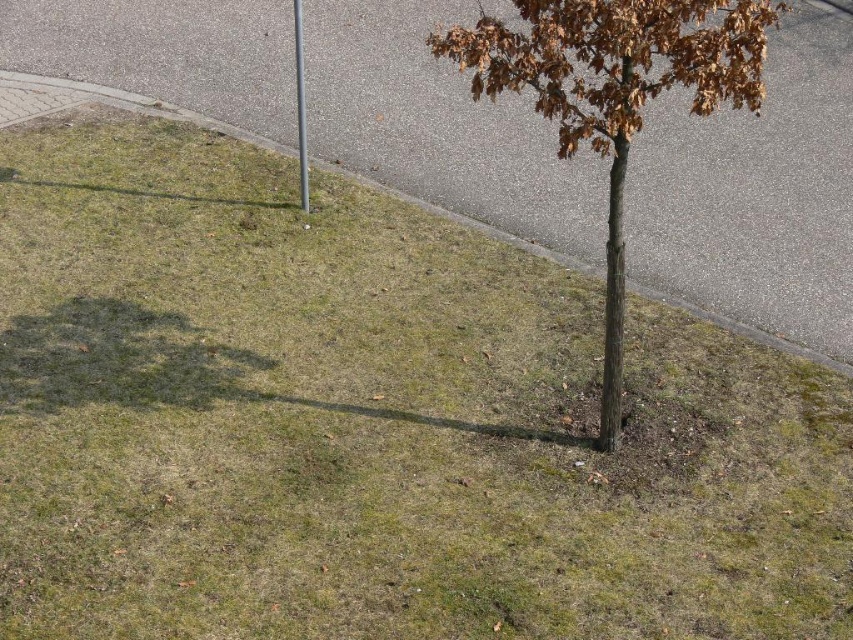
Question: Is brown rough bark tree at center positioned in front of silver metallic pole at center?

Choices:
 (A) no
 (B) yes

Answer: (B)

Question: Which is nearer to the brown rough bark tree at center?

Choices:
 (A) silver metallic pole at center
 (B) gray asphalt curb at lower left

Answer: (A)

Question: Does brown rough bark tree at center have a larger size compared to silver metallic pole at center?

Choices:
 (A) yes
 (B) no

Answer: (A)

Question: Is gray asphalt curb at lower left thinner than silver metallic pole at center?

Choices:
 (A) no
 (B) yes

Answer: (A)

Question: Which point appears farthest from the camera in this image?

Choices:
 (A) (744, 1)
 (B) (299, 145)
 (C) (643, 289)

Answer: (B)

Question: Which point appears closest to the camera in this image?

Choices:
 (A) (299, 88)
 (B) (579, 113)
 (C) (15, 113)

Answer: (B)